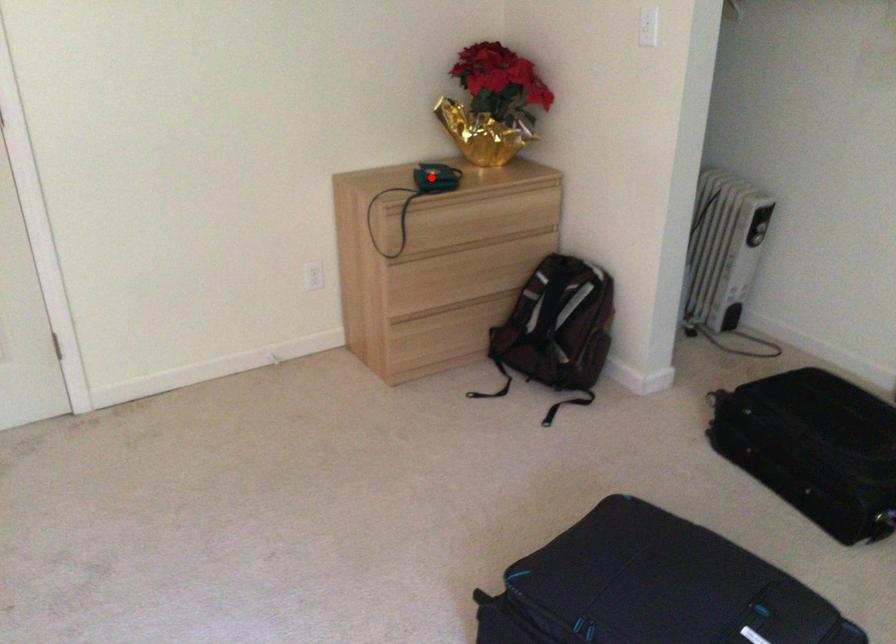
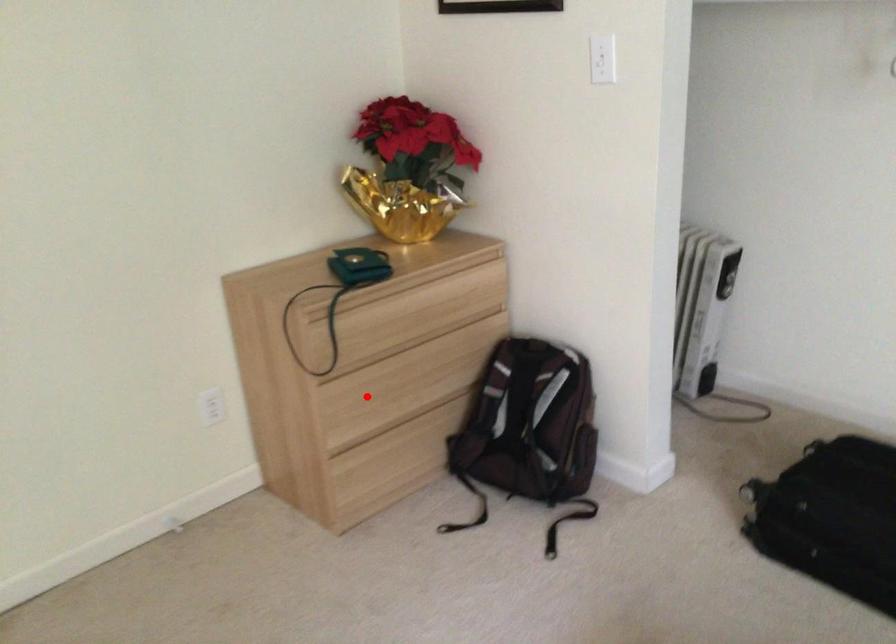
I am providing you with two images of the same scene from different viewpoints. A red point is marked on the first image and another point is marked on the second image. Do the highlighted points in image1 and image2 indicate the same real-world spot?

No